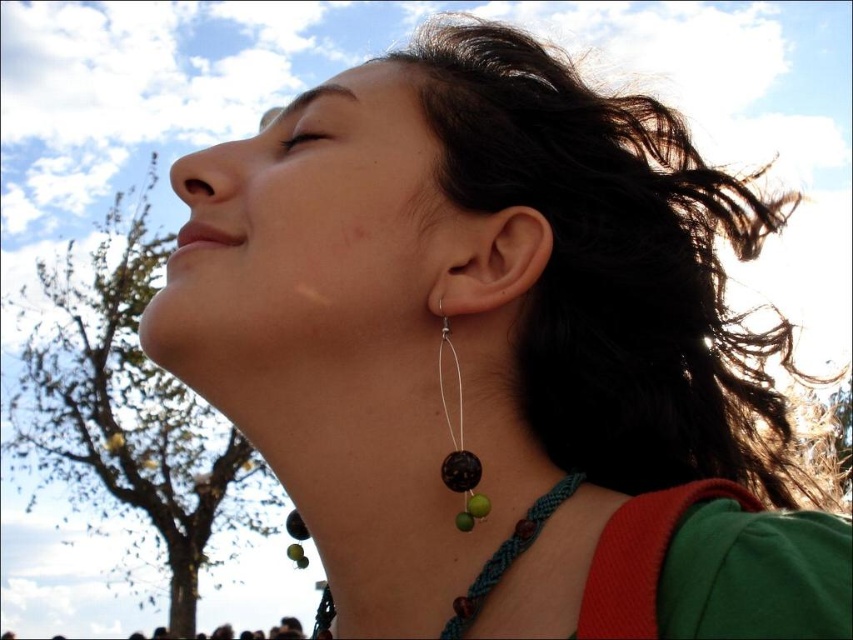
Measure the distance between green leafy tree at left and matte silver earring at center-right.

6.39 meters

Who is taller, green leafy tree at left or matte silver earring at center-right?

green leafy tree at left is taller.

In the scene shown: Who is more distant from viewer, (114, 444) or (433, 218)?

The point (114, 444) is more distant.

The image size is (853, 640). In order to click on green leafy tree at left in this screenshot , I will do `click(131, 417)`.

Does green leafy tree at left have a larger size compared to matte skin at center?

Yes.

Who is shorter, green leafy tree at left or matte skin at center?

matte skin at center is shorter.

Which is in front, point (28, 364) or point (294, 125)?

Positioned in front is point (294, 125).

The image size is (853, 640). In order to click on green leafy tree at left in this screenshot , I will do `click(131, 417)`.

Does matte silver earring at center-right have a greater height compared to black matte bead at ear?

Incorrect, matte silver earring at center-right's height is not larger of black matte bead at ear's.

At what (x,y) coordinates should I click in order to perform the action: click on matte silver earring at center-right. Please return your answer as a coordinate pair (x, y). Image resolution: width=853 pixels, height=640 pixels. Looking at the image, I should click on (482, 259).